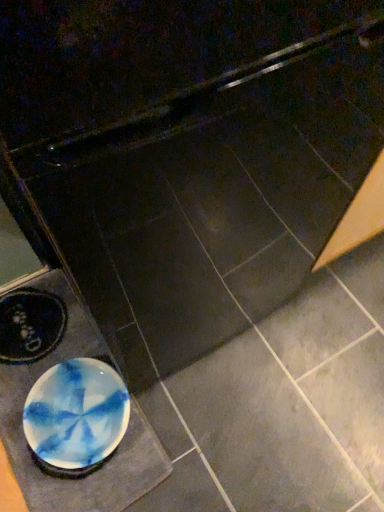
Describe the element at coordinates (35, 381) in the screenshot. I see `white glossy plate at lower left` at that location.

At what (x,y) coordinates should I click in order to perform the action: click on white glossy plate at lower left. Please return your answer as a coordinate pair (x, y). The height and width of the screenshot is (512, 384). Looking at the image, I should click on (35, 381).

Locate an element on the screen. The height and width of the screenshot is (512, 384). white glossy plate at lower left is located at coordinates (35, 381).